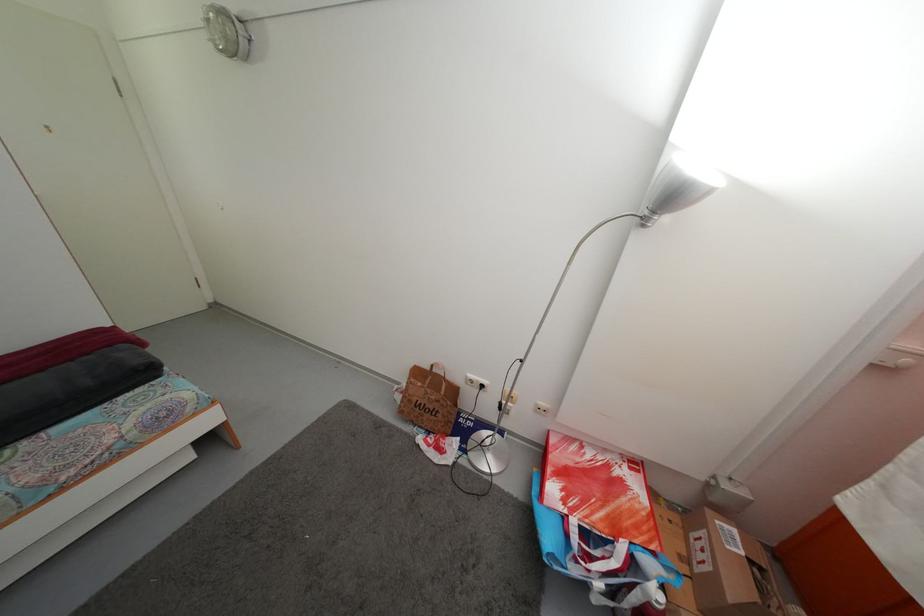
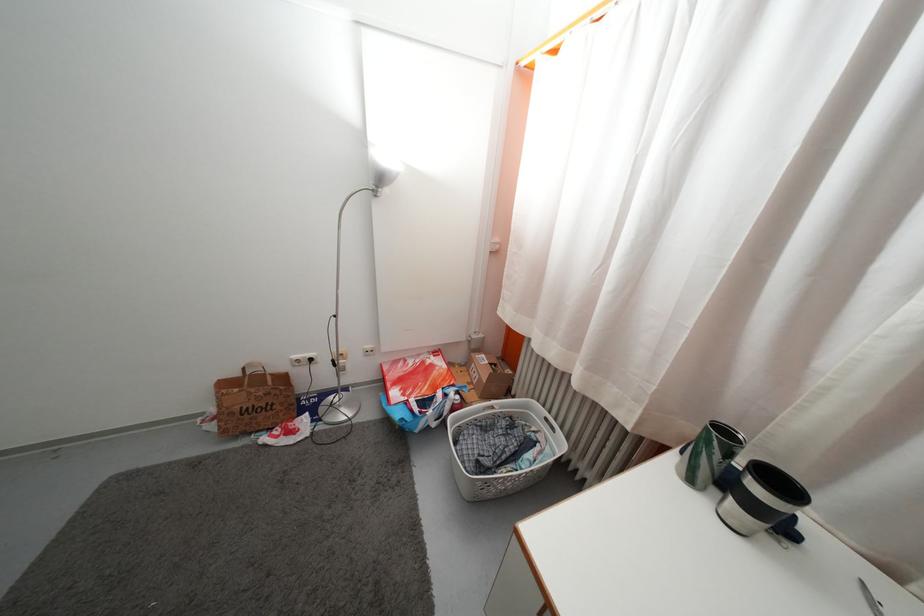
The point at (740, 538) is marked in the first image. Where is the corresponding point in the second image?

(489, 363)